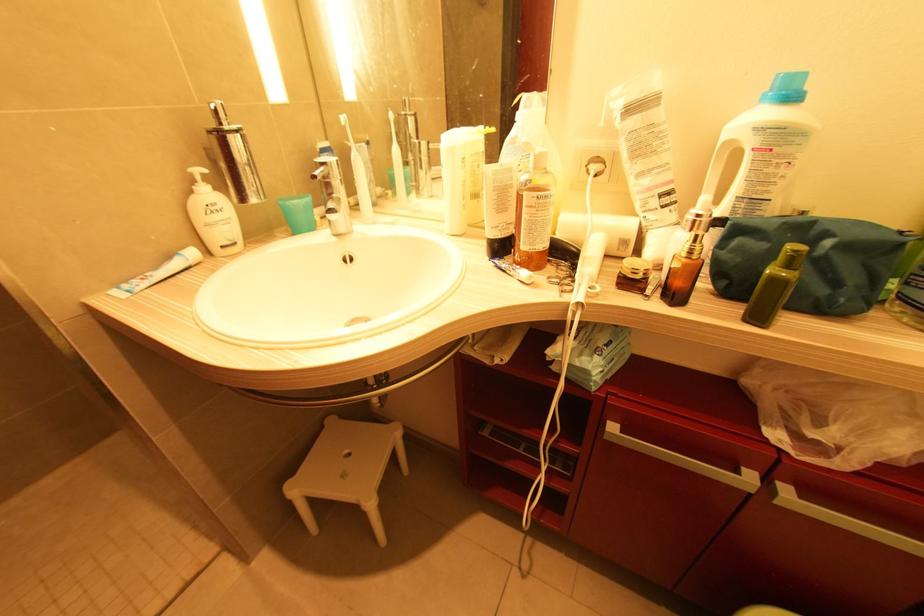
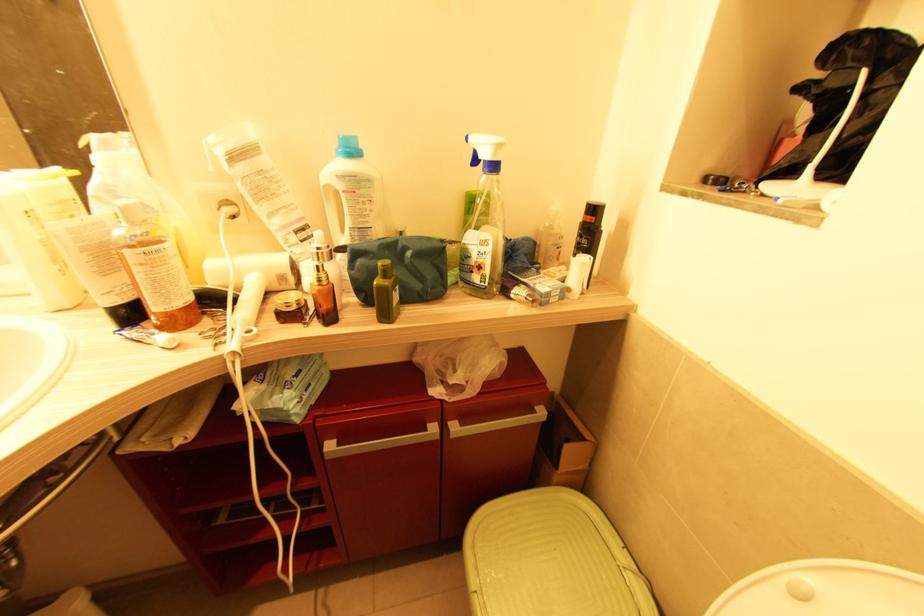
In the second image, find the point that corresponds to pixel 596 169 in the first image.

(229, 211)